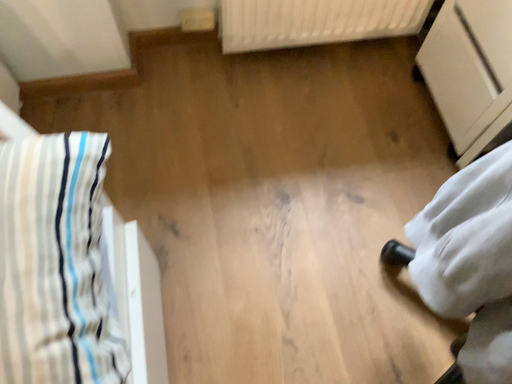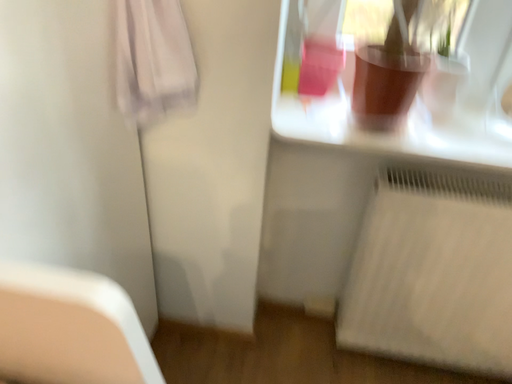
Question: Which way did the camera rotate in the video?

Choices:
 (A) rotated right
 (B) rotated left

Answer: (B)